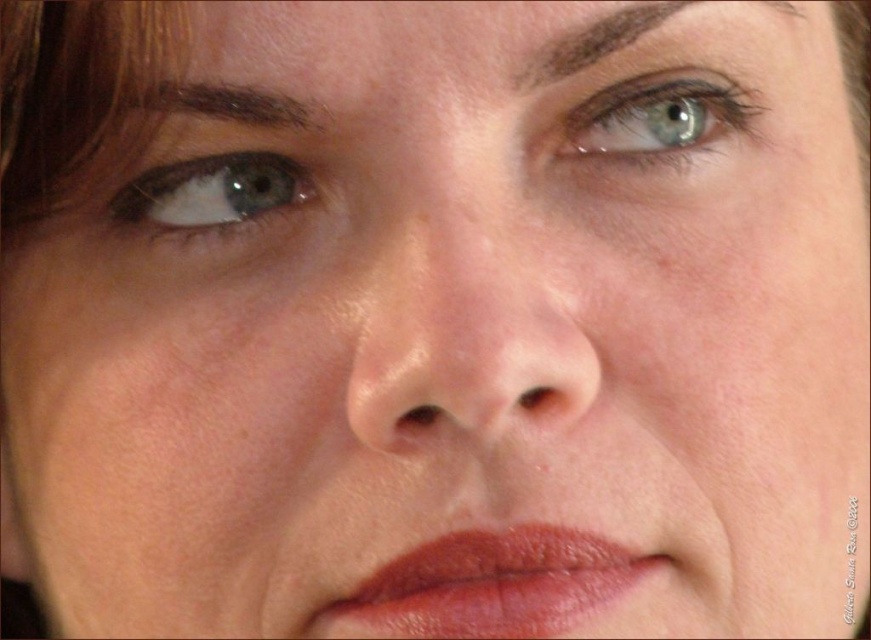
Based on the scene description, which object is taller between the blue glossy eye at upper center and the dark brown eyebrow at upper left?

The blue glossy eye at upper center is taller than the dark brown eyebrow at upper left according to the description.